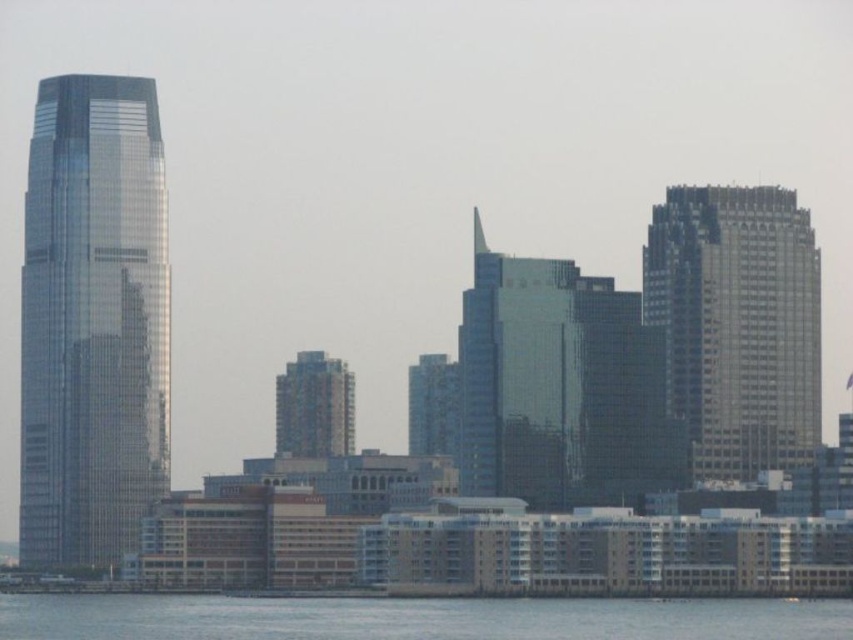
Looking at this image, between glassy blue skyscraper at center and blue glass building at center, which one has less height?

With less height is blue glass building at center.

Can you confirm if glassy blue skyscraper at center is shorter than blue glass building at center?

No, glassy blue skyscraper at center is not shorter than blue glass building at center.

Which is behind, point (527, 353) or point (321, 358)?

Point (527, 353)

Where is `glassy blue skyscraper at center`? The image size is (853, 640). glassy blue skyscraper at center is located at coordinates (560, 387).

Is point (83, 273) closer to camera compared to point (688, 616)?

Yes.

The image size is (853, 640). In order to click on shiny glass skyscraper at left in this screenshot , I will do `click(91, 321)`.

Identify the location of shiny glass skyscraper at left. The width and height of the screenshot is (853, 640). (91, 321).

Which is below, transparent water at lower center or blue glass building at center?

Positioned lower is transparent water at lower center.

Is point (128, 627) in front of point (346, 436)?

No, it is not.

This screenshot has height=640, width=853. Find the location of `transparent water at lower center`. transparent water at lower center is located at coordinates (416, 618).